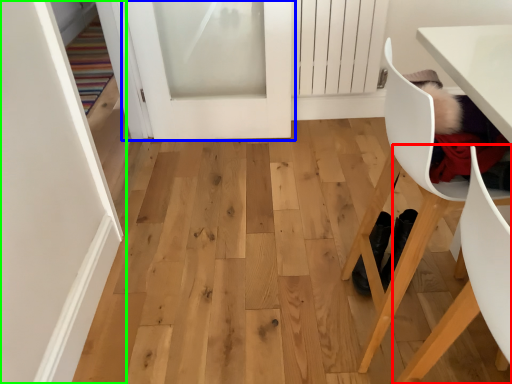
Question: Considering the real-world distances, which object is farthest from chair (highlighted by a red box)? door (highlighted by a blue box) or door (highlighted by a green box)?

Choices:
 (A) door
 (B) door

Answer: (A)